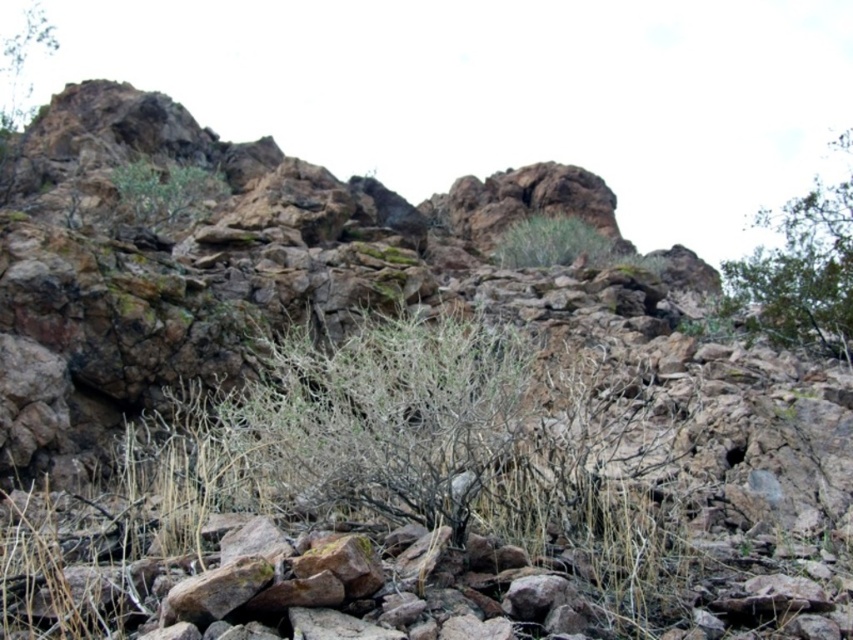
You are a botanist studying plant distribution in this rocky landscape. You notice the green leafy bush at upper center. Based on its location, can you determine if it is closer to the foreground or the background?

The green leafy bush at upper center is located at point (163,193), which places it closer to the foreground than the background.

You are standing in the middle of the rocky landscape and want to walk towards the two points marked in the image. Which point, point (204, 170) or point (558, 227), will you reach first?

You will reach point (204, 170) first because it is closer to you than point (558, 227), which is further away.

You are a botanist examining the image of a rugged, rocky landscape. You notice the green leafy bush at upper center and the green grass at upper center. Based on the spatial relationship between them, which one do you think is wider?

The green leafy bush at upper center might be wider than green grass at upper center according to the description.